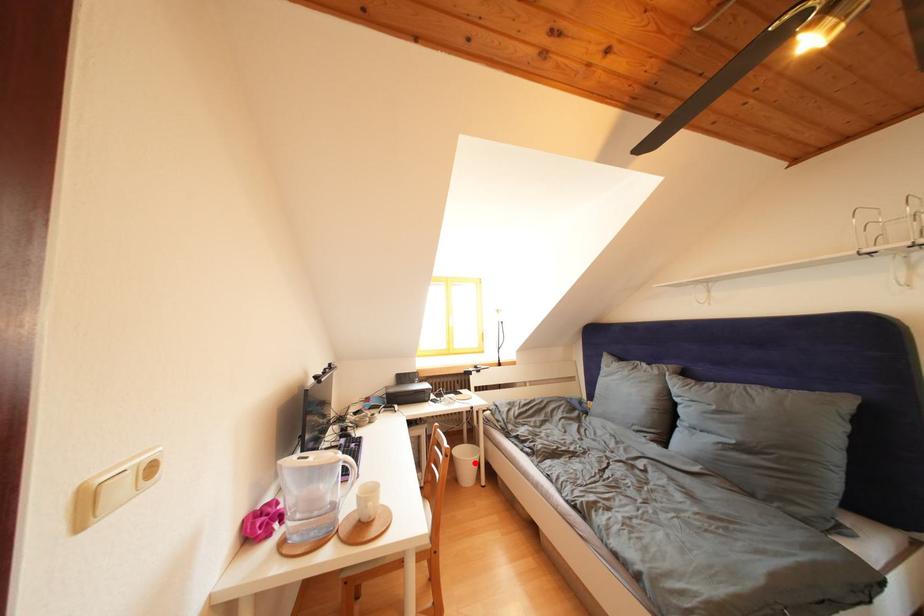
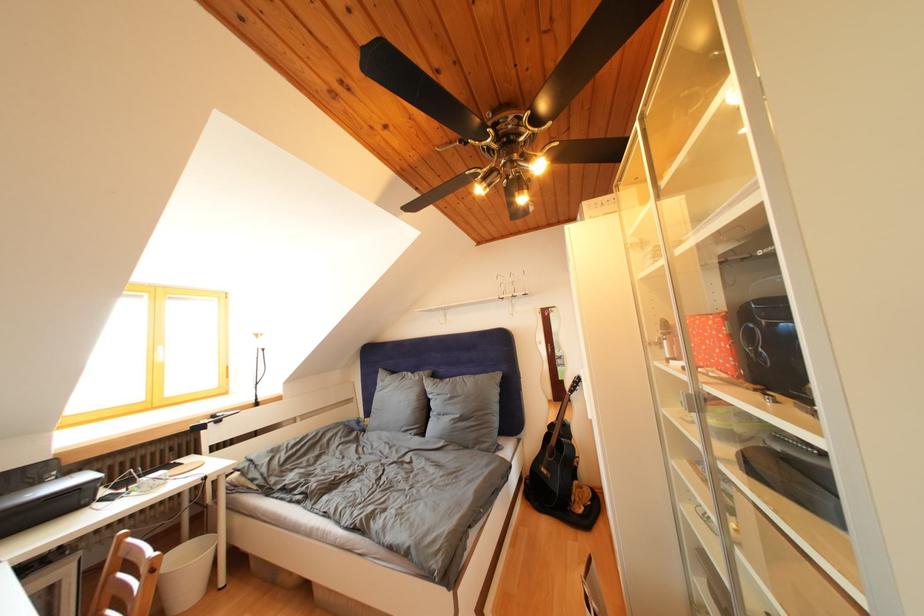
Locate, in the second image, the point that corresponds to the highlighted location in the first image.

(198, 565)